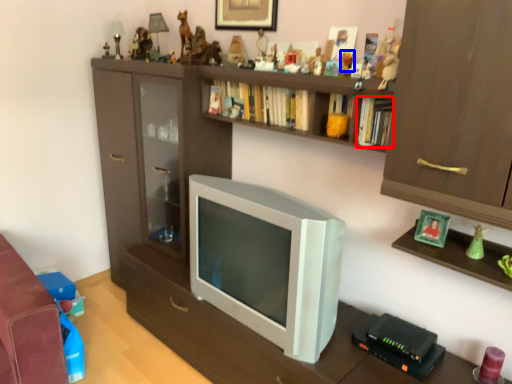
Question: Which object is closer to the camera taking this photo, book (highlighted by a red box) or toy (highlighted by a blue box)?

Choices:
 (A) book
 (B) toy

Answer: (A)